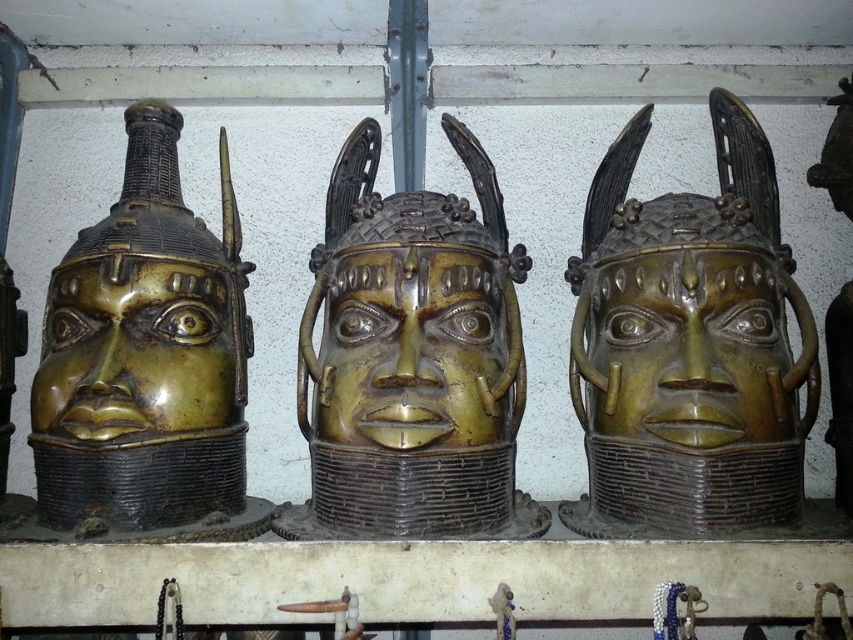
Question: Is bronze helmet at center further to the viewer compared to gold-bronze helmet at left?

Choices:
 (A) no
 (B) yes

Answer: (A)

Question: Among these objects, which one is farthest from the camera?

Choices:
 (A) bronze mask at center
 (B) gold-bronze mask at center

Answer: (A)

Question: Where is bronze helmet at center located in relation to gold-bronze mask at center in the image?

Choices:
 (A) below
 (B) above

Answer: (B)

Question: Which point is farther to the camera?

Choices:
 (A) gold-bronze helmet at left
 (B) gold-bronze mask at left
 (C) gold-bronze mask at center

Answer: (B)

Question: Where is bronze helmet at center located in relation to gold-bronze mask at left in the image?

Choices:
 (A) above
 (B) below

Answer: (A)

Question: Which of the following is the closest to the observer?

Choices:
 (A) bronze helmet at center
 (B) gold-bronze helmet at center

Answer: (B)